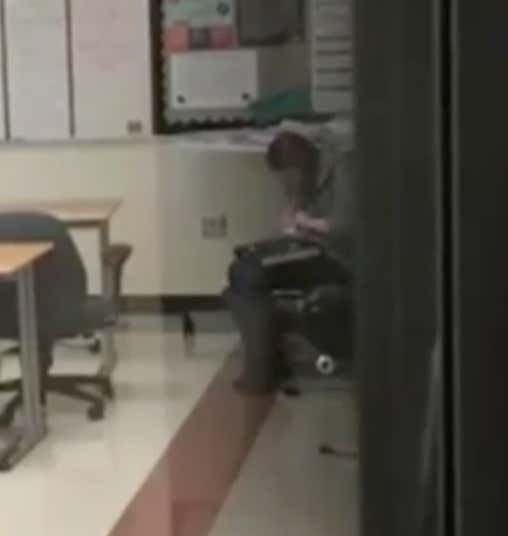
What are the coordinates of `wheels of chair` in the screenshot? It's located at (102, 412), (9, 419), (109, 393).